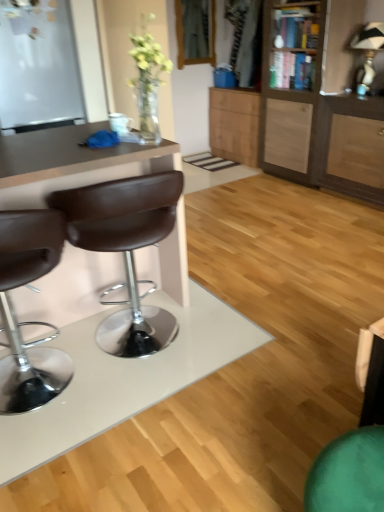
Question: From the image's perspective, is brown leather desk at left above or below white matte glass door at upper left?

Choices:
 (A) below
 (B) above

Answer: (A)

Question: In the image, is brown leather desk at left positioned in front of or behind white matte glass door at upper left?

Choices:
 (A) behind
 (B) front

Answer: (B)

Question: Based on their relative distances, which object is nearer to the brown leather stool at left, placed as the 2th chair when sorted from right to left?

Choices:
 (A) brown leather desk at left
 (B) brown leather stool at left, which appears as the 2th chair when viewed from the left
 (C) white matte glass door at upper left
 (D) wooden cabinet at right, the 2th cabinetry positioned from the back
 (E) wooden cabinet at center, which appears as the 1th cabinetry when viewed from the back

Answer: (B)

Question: Based on their relative distances, which object is nearer to the wooden cabinet at center, which appears as the 1th cabinetry when viewed from the back?

Choices:
 (A) brown leather desk at left
 (B) brown leather stool at left, arranged as the 1th chair when viewed from the right
 (C) white matte glass door at upper left
 (D) brown leather stool at left, placed as the 2th chair when sorted from right to left
 (E) wooden cabinet at right, the 2th cabinetry positioned from the back

Answer: (E)